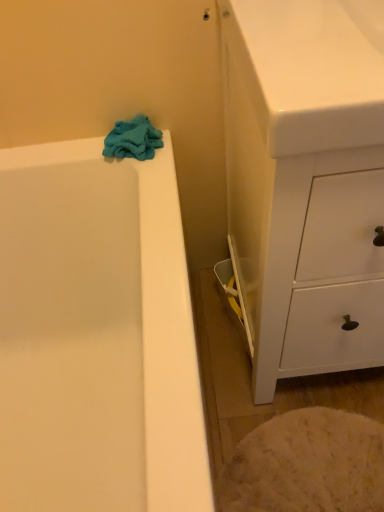
Question: Considering the relative sizes of white matte cabinet at right and teal soft towel at upper left in the image provided, is white matte cabinet at right thinner than teal soft towel at upper left?

Choices:
 (A) no
 (B) yes

Answer: (A)

Question: Is white matte cabinet at right completely or partially outside of teal soft towel at upper left?

Choices:
 (A) yes
 (B) no

Answer: (A)

Question: Is there a large distance between white matte cabinet at right and teal soft towel at upper left?

Choices:
 (A) yes
 (B) no

Answer: (B)

Question: Is white matte cabinet at right at the left side of teal soft towel at upper left?

Choices:
 (A) yes
 (B) no

Answer: (B)

Question: Does white matte cabinet at right turn towards teal soft towel at upper left?

Choices:
 (A) yes
 (B) no

Answer: (B)

Question: Considering the relative sizes of white matte cabinet at right and teal soft towel at upper left in the image provided, is white matte cabinet at right wider than teal soft towel at upper left?

Choices:
 (A) no
 (B) yes

Answer: (B)

Question: Considering the relative sizes of teal soft towel at upper left and white matte cabinet at right in the image provided, is teal soft towel at upper left wider than white matte cabinet at right?

Choices:
 (A) no
 (B) yes

Answer: (A)

Question: From a real-world perspective, does teal soft towel at upper left sit lower than white matte cabinet at right?

Choices:
 (A) yes
 (B) no

Answer: (B)

Question: Is teal soft towel at upper left at the right side of white matte cabinet at right?

Choices:
 (A) yes
 (B) no

Answer: (B)

Question: Is teal soft towel at upper left outside white matte cabinet at right?

Choices:
 (A) yes
 (B) no

Answer: (A)

Question: Is teal soft towel at upper left thinner than white matte cabinet at right?

Choices:
 (A) yes
 (B) no

Answer: (A)

Question: Is teal soft towel at upper left further to camera compared to white matte cabinet at right?

Choices:
 (A) no
 (B) yes

Answer: (B)

Question: From their relative heights in the image, would you say teal soft towel at upper left is taller or shorter than white matte cabinet at right?

Choices:
 (A) tall
 (B) short

Answer: (B)